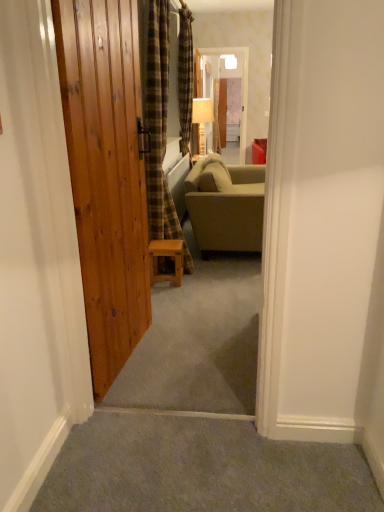
Question: From the image's perspective, is translucent plastic screen door at center above natural wood door at left?

Choices:
 (A) no
 (B) yes

Answer: (B)

Question: Are translucent plastic screen door at center and natural wood door at left making contact?

Choices:
 (A) no
 (B) yes

Answer: (A)

Question: Is translucent plastic screen door at center to the left of natural wood door at left from the viewer's perspective?

Choices:
 (A) yes
 (B) no

Answer: (B)

Question: Can you confirm if translucent plastic screen door at center is thinner than natural wood door at left?

Choices:
 (A) no
 (B) yes

Answer: (A)

Question: From a real-world perspective, does translucent plastic screen door at center sit lower than natural wood door at left?

Choices:
 (A) no
 (B) yes

Answer: (A)

Question: In the image, is natural wood door at left positioned in front of or behind translucent plastic screen door at center?

Choices:
 (A) behind
 (B) front

Answer: (B)

Question: Considering the positions of natural wood door at left and translucent plastic screen door at center in the image, is natural wood door at left taller or shorter than translucent plastic screen door at center?

Choices:
 (A) tall
 (B) short

Answer: (A)

Question: Is natural wood door at left situated inside translucent plastic screen door at center or outside?

Choices:
 (A) outside
 (B) inside

Answer: (A)

Question: From a real-world perspective, is natural wood door at left above or below translucent plastic screen door at center?

Choices:
 (A) above
 (B) below

Answer: (B)

Question: Would you say wooden stool at center is to the left or to the right of natural wood door at left in the picture?

Choices:
 (A) left
 (B) right

Answer: (B)

Question: Considering the positions of wooden stool at center and natural wood door at left in the image, is wooden stool at center wider or thinner than natural wood door at left?

Choices:
 (A) thin
 (B) wide

Answer: (B)

Question: From their relative heights in the image, would you say wooden stool at center is taller or shorter than natural wood door at left?

Choices:
 (A) tall
 (B) short

Answer: (B)

Question: Relative to natural wood door at left, is wooden stool at center in front or behind?

Choices:
 (A) behind
 (B) front

Answer: (A)

Question: From the image's perspective, is wooden textured lamp at center positioned above or below natural wood door at left?

Choices:
 (A) below
 (B) above

Answer: (B)

Question: Is wooden textured lamp at center inside or outside of natural wood door at left?

Choices:
 (A) outside
 (B) inside

Answer: (A)